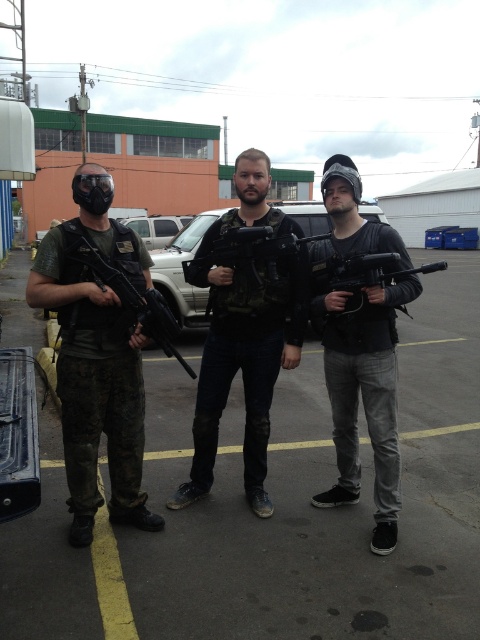
You are an airsoft player preparing to join a game. You see a matte black helmet at center and a matte black rifle at left. Which item should you pick up first if you want to grab the larger one first?

The matte black helmet at center is bigger than the matte black rifle at left, so you should pick up the matte black helmet at center first.

You are an airsoft player who needs to place your matte black rifle at left on a stable surface. Can you put it on the concrete pavement at center?

Yes, you can place the matte black rifle at left on the concrete pavement at center because the concrete pavement at center is below the rifle, providing a stable surface.